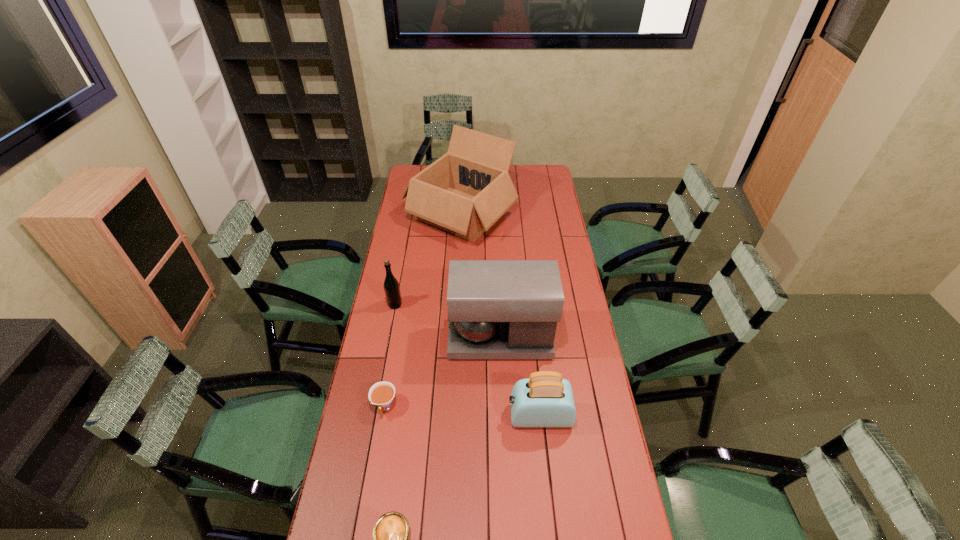
Where is `object at the far left corner`? The image size is (960, 540). object at the far left corner is located at coordinates (464, 192).

The width and height of the screenshot is (960, 540). In the image, there is a desktop. What are the coordinates of `vacant space at the left edge` in the screenshot? It's located at (392, 455).

Locate an element on the screen. free space at the right edge of the desktop is located at coordinates (599, 448).

Find the location of `vacant space at the far left corner of the desktop`. vacant space at the far left corner of the desktop is located at coordinates (409, 173).

The width and height of the screenshot is (960, 540). I want to click on vacant space at the far right corner, so click(x=542, y=171).

Locate an element on the screen. Image resolution: width=960 pixels, height=540 pixels. free space between the beer bottle and the farthest object is located at coordinates (428, 260).

Find the location of a particular element. The height and width of the screenshot is (540, 960). empty space that is in between the box and the beer bottle is located at coordinates (428, 260).

At what (x,y) coordinates should I click in order to perform the action: click on vacant area that lies between the second farthest object and the toaster. Please return your answer as a coordinate pair (x, y). This screenshot has width=960, height=540. Looking at the image, I should click on (468, 360).

The height and width of the screenshot is (540, 960). Identify the location of vacant space in between the beer bottle and the toaster. (468, 360).

Find the location of a particular element. This screenshot has width=960, height=540. free space between the coffee maker and the beer bottle is located at coordinates (447, 322).